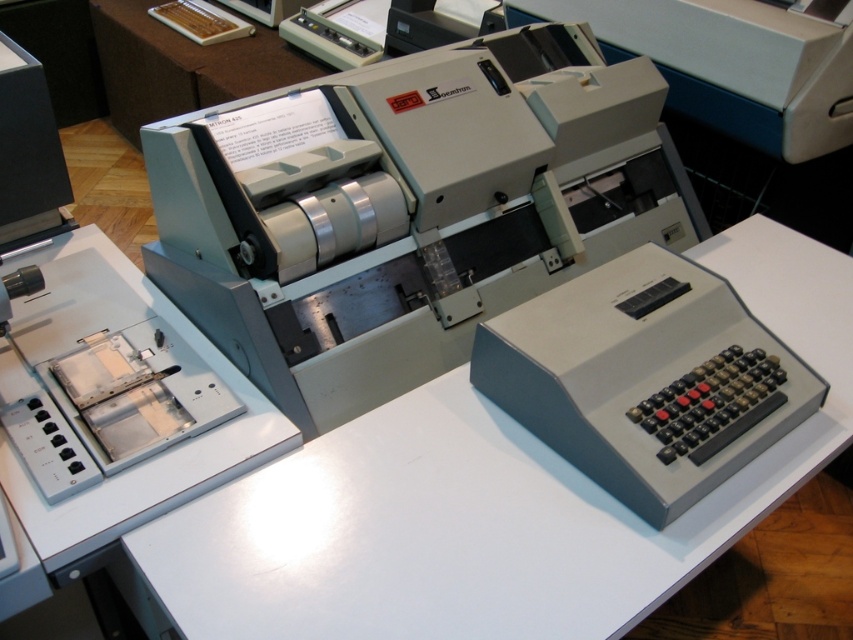
Question: Does satin gray printer at center appear under white matte table at center?

Choices:
 (A) no
 (B) yes

Answer: (A)

Question: Which object appears closest to the camera in this image?

Choices:
 (A) satin gray printer at center
 (B) white matte table at center

Answer: (B)

Question: Does satin gray printer at center come in front of white matte table at center?

Choices:
 (A) no
 (B) yes

Answer: (A)

Question: Which is farther from the satin gray printer at center?

Choices:
 (A) white matte table at center
 (B) gray plastic calculator at lower right

Answer: (B)

Question: Is white matte table at center positioned behind gray plastic calculator at lower right?

Choices:
 (A) yes
 (B) no

Answer: (B)

Question: Which object appears closest to the camera in this image?

Choices:
 (A) white matte table at center
 (B) satin gray printer at center

Answer: (A)